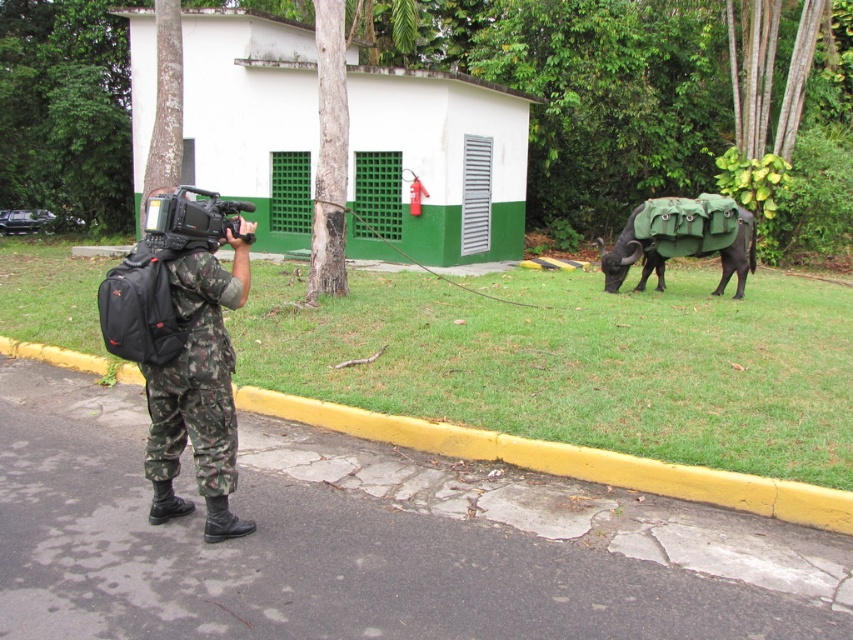
You are standing in front of the small white building with green accents and notice two points marked on the ground. One is at point coordinates point (196,378) and the other at point (231,208). Which point is closer to you?

Point (196,378) is closer to the viewer than point (231,208).